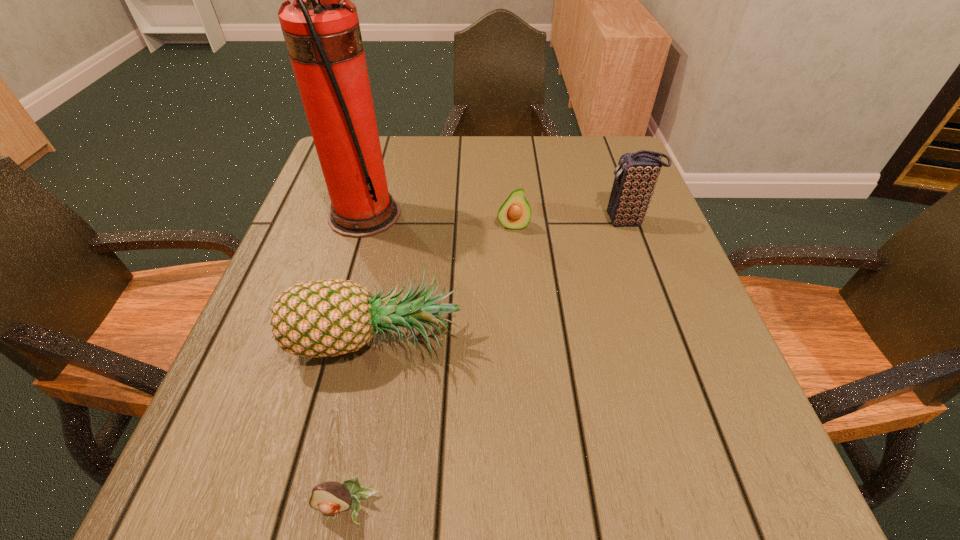
Identify the location of vacant space located with the zip open on the rightmost object. The width and height of the screenshot is (960, 540). (549, 221).

You are a GUI agent. You are given a task and a screenshot of the screen. Output one action in this format:
    pyautogui.click(x=<x>, y=<y>)
    Task: Click on the vacant area situated with the zip open on the rightmost object
    Image resolution: width=960 pixels, height=540 pixels.
    Given the screenshot: What is the action you would take?
    coord(522,221)

Where is `vacant space positioned 0.400m on the right of the pineapple`? vacant space positioned 0.400m on the right of the pineapple is located at coordinates (695, 337).

Image resolution: width=960 pixels, height=540 pixels. I want to click on blank area located 0.380m on the cut side of the fourth tallest object, so click(526, 389).

I want to click on object present at the near edge, so click(330, 497).

Image resolution: width=960 pixels, height=540 pixels. I want to click on fire extinguisher at the left edge, so click(321, 29).

Find the location of a particular element. This screenshot has width=960, height=540. pineapple that is at the left edge is located at coordinates (325, 318).

This screenshot has width=960, height=540. Identify the location of object at the right edge. [636, 175].

I want to click on free space at the far edge of the desktop, so click(x=517, y=174).

Where is `vacant region at the near edge`? vacant region at the near edge is located at coordinates (447, 491).